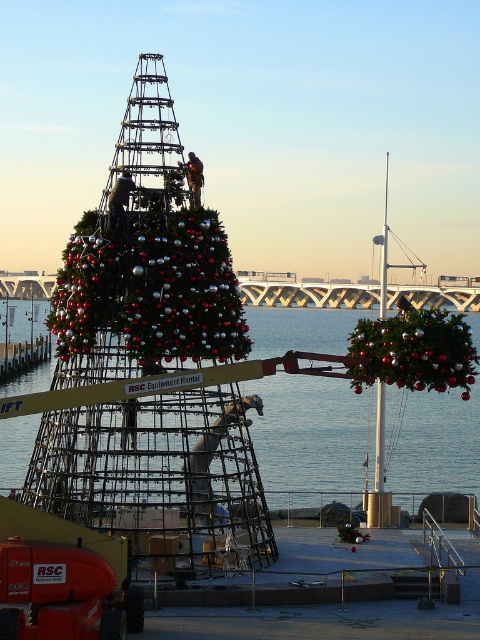
Question: Is shiny metallic garland at right positioned in front of shiny metallic christmas tree at left?

Choices:
 (A) no
 (B) yes

Answer: (B)

Question: Based on their relative distances, which object is nearer to the shiny metallic christmas tree at left?

Choices:
 (A) clear blue water at center
 (B) shiny metallic garland at right

Answer: (B)

Question: Which point appears closest to the camera in this image?

Choices:
 (A) (357, 369)
 (B) (67, 321)

Answer: (A)

Question: Observing the image, what is the correct spatial positioning of clear blue water at center in reference to shiny metallic christmas tree at left?

Choices:
 (A) below
 (B) above

Answer: (A)

Question: Among these objects, which one is nearest to the camera?

Choices:
 (A) shiny metallic garland at right
 (B) shiny metallic christmas tree at left
 (C) clear blue water at center

Answer: (A)

Question: In this image, where is clear blue water at center located relative to shiny metallic christmas tree at left?

Choices:
 (A) right
 (B) left

Answer: (A)